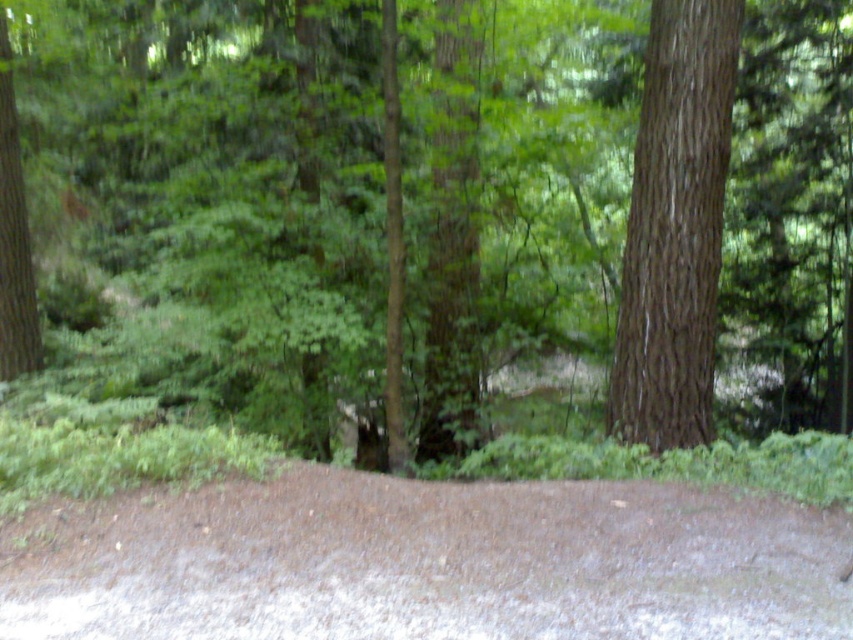
Question: Does green leafy forest at center appear over brown dirt path at lower center?

Choices:
 (A) no
 (B) yes

Answer: (B)

Question: Which point is closer to the camera?

Choices:
 (A) brown dirt path at lower center
 (B) brown rough bark tree at right

Answer: (A)

Question: Which object is closer to the camera taking this photo?

Choices:
 (A) brown dirt path at lower center
 (B) brown rough bark tree at right

Answer: (A)

Question: Is green leafy forest at center to the right of brown dirt path at lower center from the viewer's perspective?

Choices:
 (A) yes
 (B) no

Answer: (A)

Question: Which point is closer to the camera?

Choices:
 (A) brown dirt path at lower center
 (B) brown rough bark tree at right
 (C) green leafy forest at center

Answer: (A)

Question: Where is green leafy forest at center located in relation to brown rough bark tree at right in the image?

Choices:
 (A) left
 (B) right

Answer: (A)